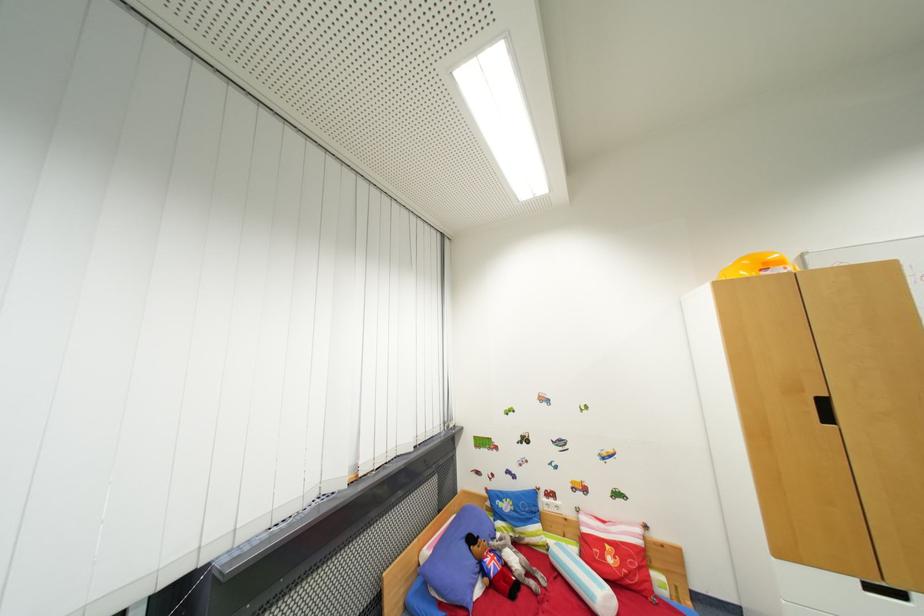
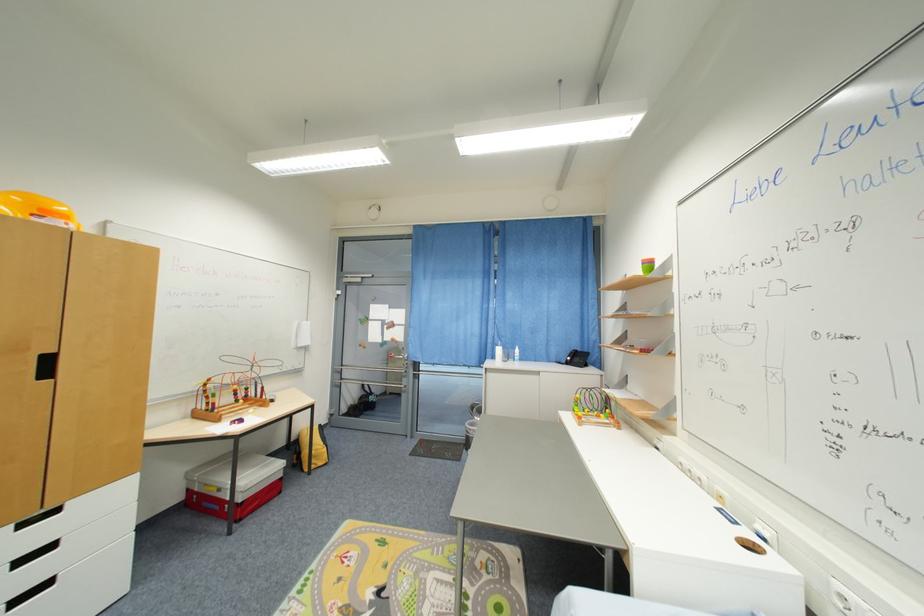
Question: Based on the continuous images, in which direction is the camera rotating? Reply with the corresponding letter.

Choices:
 (A) Left
 (B) Right
 (C) Up
 (D) Down

Answer: (B)